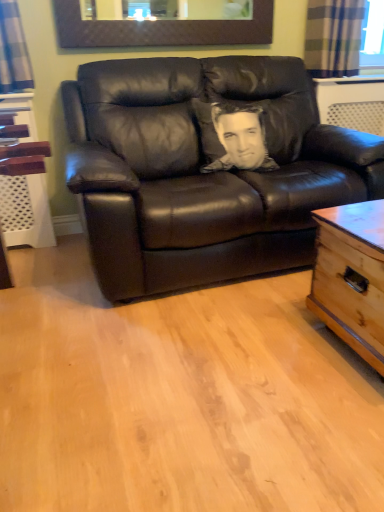
Describe the element at coordinates (333, 37) in the screenshot. I see `plaid fabric curtain at upper right` at that location.

Measure the distance between sepia-toned pillow at center and camera.

sepia-toned pillow at center is 2.09 meters from camera.

Image resolution: width=384 pixels, height=512 pixels. What do you see at coordinates (202, 170) in the screenshot?
I see `matte black leather couch at center` at bounding box center [202, 170].

The height and width of the screenshot is (512, 384). Identify the location of plaid fabric curtain at upper right. (333, 37).

Can you confirm if matte black leather couch at center is thinner than light brown wooden trunk at right?

In fact, matte black leather couch at center might be wider than light brown wooden trunk at right.

Is matte black leather couch at center looking in the opposite direction of light brown wooden trunk at right?

No.

Between matte black leather couch at center and light brown wooden trunk at right, which one has more height?

matte black leather couch at center is taller.

Can you confirm if matte brown picture frame at upper center is smaller than plaid fabric curtain at upper right?

Yes.

Looking at this image, from a real-world perspective, is matte brown picture frame at upper center positioned under plaid fabric curtain at upper right based on gravity?

Actually, matte brown picture frame at upper center is physically above plaid fabric curtain at upper right in the real world.

Which is in front, matte brown picture frame at upper center or plaid fabric curtain at upper right?

matte brown picture frame at upper center is in front.

Is matte brown picture frame at upper center touching plaid fabric curtain at upper right?

No, matte brown picture frame at upper center is not making contact with plaid fabric curtain at upper right.

From the image's perspective, which is below, light brown wooden trunk at right or matte brown picture frame at upper center?

From the image's view, light brown wooden trunk at right is below.

Between light brown wooden trunk at right and matte brown picture frame at upper center, which one has larger width?

light brown wooden trunk at right is wider.

Is light brown wooden trunk at right not close to plaid fabric curtain at upper right?

Yes, light brown wooden trunk at right and plaid fabric curtain at upper right are located far from each other.

Consider the image. Is light brown wooden trunk at right taller or shorter than plaid fabric curtain at upper right?

Considering their sizes, light brown wooden trunk at right has more height than plaid fabric curtain at upper right.

Consider the image. Is light brown wooden trunk at right positioned beyond the bounds of plaid fabric curtain at upper right?

That's correct, light brown wooden trunk at right is outside of plaid fabric curtain at upper right.

Considering their positions, is light brown wooden trunk at right located in front of or behind plaid fabric curtain at upper right?

In the image, light brown wooden trunk at right appears in front of plaid fabric curtain at upper right.

Locate an element on the screen. This screenshot has height=512, width=384. curtain on the right side of sepia-toned pillow at center is located at coordinates (333, 37).

Which is closer to the camera, (x=330, y=4) or (x=237, y=124)?

Point (x=330, y=4).

Based on the photo, considering the sizes of plaid fabric curtain at upper right and sepia-toned pillow at center in the image, is plaid fabric curtain at upper right wider or thinner than sepia-toned pillow at center?

In the image, plaid fabric curtain at upper right appears to be more narrow than sepia-toned pillow at center.

Is plaid fabric curtain at upper right inside or outside of sepia-toned pillow at center?

plaid fabric curtain at upper right exists outside the volume of sepia-toned pillow at center.

From the image's perspective, between plaid fabric curtain at upper right and matte black leather couch at center, which one is located above?

plaid fabric curtain at upper right appears higher in the image.

In terms of height, does plaid fabric curtain at upper right look taller or shorter compared to matte black leather couch at center?

In the image, plaid fabric curtain at upper right appears to be shorter than matte black leather couch at center.

Is plaid fabric curtain at upper right wider or thinner than matte black leather couch at center?

In the image, plaid fabric curtain at upper right appears to be more narrow than matte black leather couch at center.

Between matte brown picture frame at upper center and matte black leather couch at center, which one has larger width?

With larger width is matte black leather couch at center.

This screenshot has width=384, height=512. In the image, there is a matte black leather couch at center. What are the coordinates of `picture frame above it (from the image's perspective)` in the screenshot? It's located at (161, 30).

Does matte brown picture frame at upper center turn towards matte black leather couch at center?

No.

Image resolution: width=384 pixels, height=512 pixels. In order to click on studio couch located behind the light brown wooden trunk at right in this screenshot , I will do `click(202, 170)`.

At what (x,y) coordinates should I click in order to perform the action: click on picture frame located below the plaid fabric curtain at upper right (from the image's perspective). Please return your answer as a coordinate pair (x, y). This screenshot has width=384, height=512. Looking at the image, I should click on (161, 30).

From the image, which object appears to be nearer to matte black leather couch at center, matte brown picture frame at upper center or plaid fabric curtain at upper right?

Based on the image, matte brown picture frame at upper center appears to be nearer to matte black leather couch at center.

From the image, which object appears to be nearer to sepia-toned pillow at center, matte black leather couch at center or matte brown picture frame at upper center?

matte black leather couch at center lies closer to sepia-toned pillow at center than the other object.

Considering their positions, is light brown wooden trunk at right positioned closer to sepia-toned pillow at center than matte black leather couch at center?

matte black leather couch at center.

Estimate the real-world distances between objects in this image. Which object is further from matte black leather couch at center, sepia-toned pillow at center or light brown wooden trunk at right?

Among the two, light brown wooden trunk at right is located further to matte black leather couch at center.

Based on their spatial positions, is plaid fabric curtain at upper right or matte black leather couch at center closer to matte brown picture frame at upper center?

Among the two, plaid fabric curtain at upper right is located nearer to matte brown picture frame at upper center.

Based on their spatial positions, is sepia-toned pillow at center or light brown wooden trunk at right further from plaid fabric curtain at upper right?

Among the two, light brown wooden trunk at right is located further to plaid fabric curtain at upper right.

Based on their spatial positions, is matte black leather couch at center or matte brown picture frame at upper center further from light brown wooden trunk at right?

The object further to light brown wooden trunk at right is matte brown picture frame at upper center.

Considering their positions, is light brown wooden trunk at right positioned further to plaid fabric curtain at upper right than matte black leather couch at center?

The object further to plaid fabric curtain at upper right is light brown wooden trunk at right.

Where is `man between plaid fabric curtain at upper right and light brown wooden trunk at right in the up-down direction`? Image resolution: width=384 pixels, height=512 pixels. man between plaid fabric curtain at upper right and light brown wooden trunk at right in the up-down direction is located at coordinates (240, 139).

Identify the location of studio couch between plaid fabric curtain at upper right and light brown wooden trunk at right in the up-down direction. The image size is (384, 512). (202, 170).

In order to click on man between matte brown picture frame at upper center and light brown wooden trunk at right from top to bottom in this screenshot , I will do `click(240, 139)`.

Image resolution: width=384 pixels, height=512 pixels. I want to click on man between matte brown picture frame at upper center and matte black leather couch at center from top to bottom, so click(x=240, y=139).